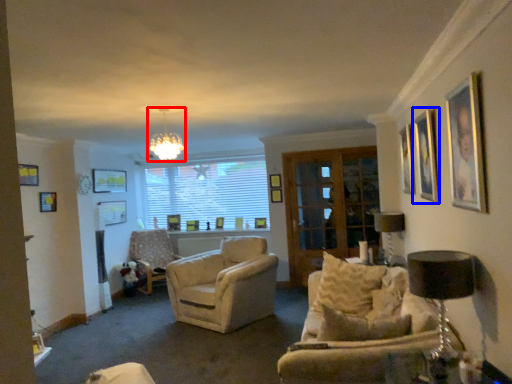
Question: Which object is closer to the camera taking this photo, light fixture (highlighted by a red box) or picture frame (highlighted by a blue box)?

Choices:
 (A) light fixture
 (B) picture frame

Answer: (B)